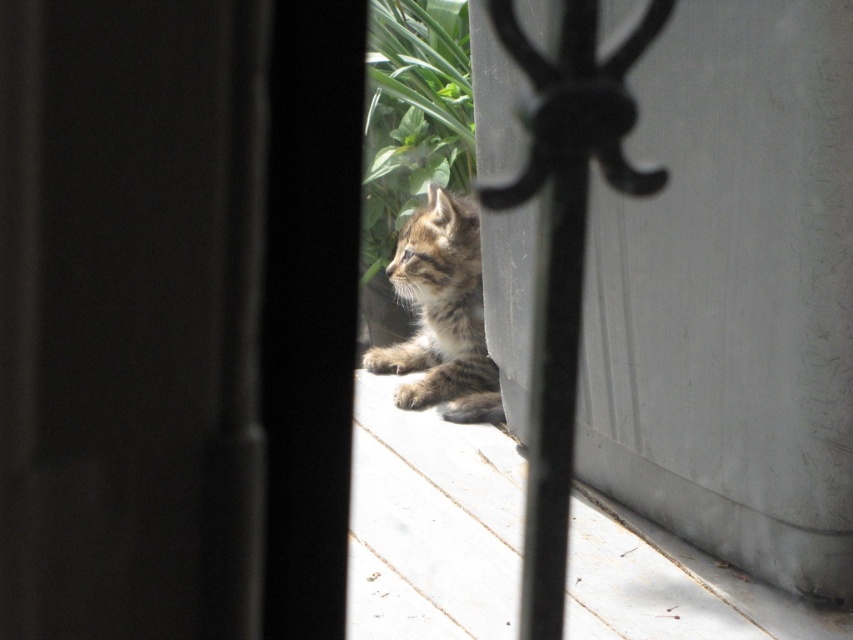
You are standing outside the frame and want to throw a small toy to the kitten. The toy can land at either point (132,422) or point (456,220). Which point is closer to the kitten?

Point (132,422) is closer to the kitten because it is in front of point (456,220).

You are a cat owner looking through the partially open door or window. You see the white wood at lower center and the striped fur kitten at lower center. Which object is closer to the floor?

The white wood at lower center is located below striped fur kitten at lower center, so the white wood at lower center is closer to the floor.

You are standing at the entrance of the scene and see the point marked at coordinates (436, 515). What material is located at that specific point?

The point at coordinates (436, 515) corresponds to white wood at lower center.